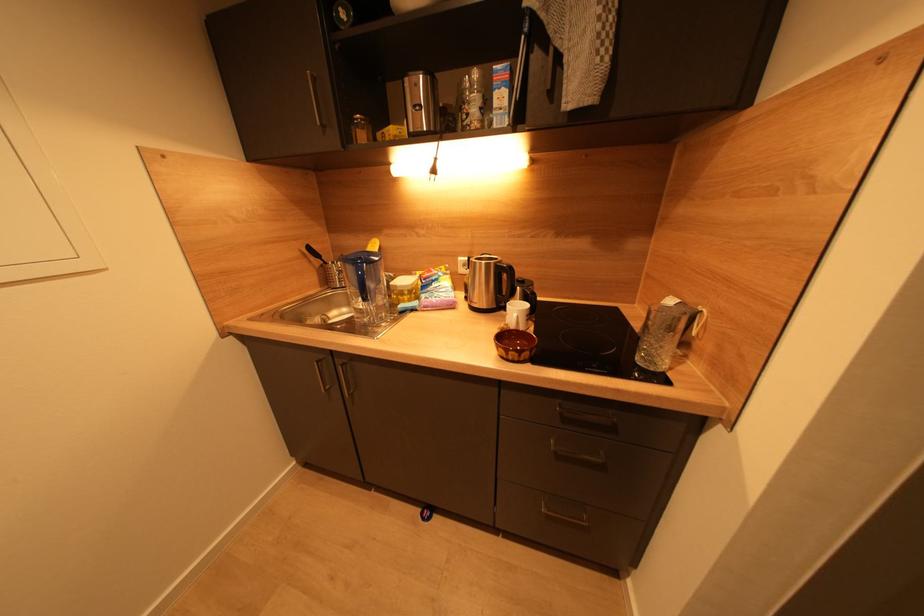
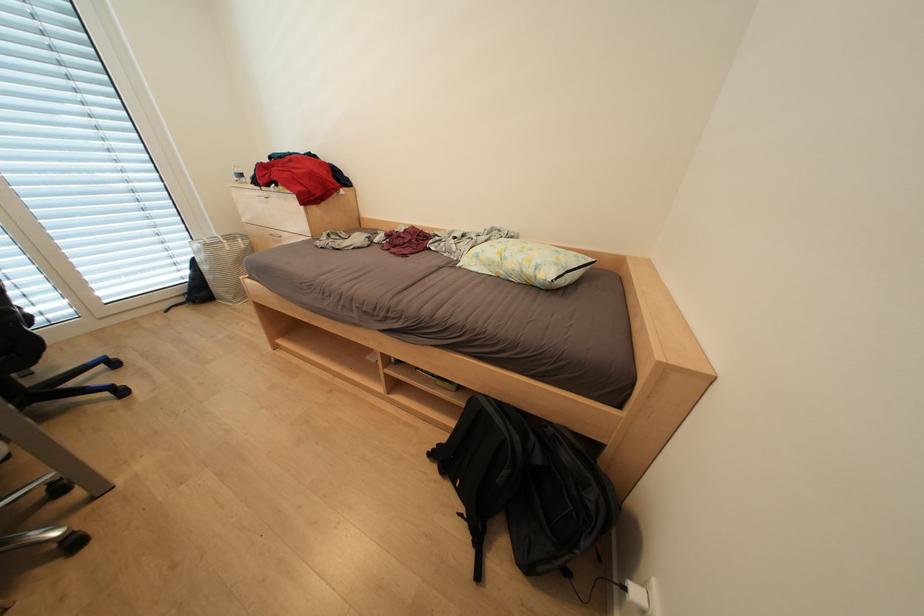
Question: The images are taken continuously from a first-person perspective. In which direction are you moving?

Choices:
 (A) Left
 (B) Right
 (C) Forward
 (D) Backward

Answer: (A)